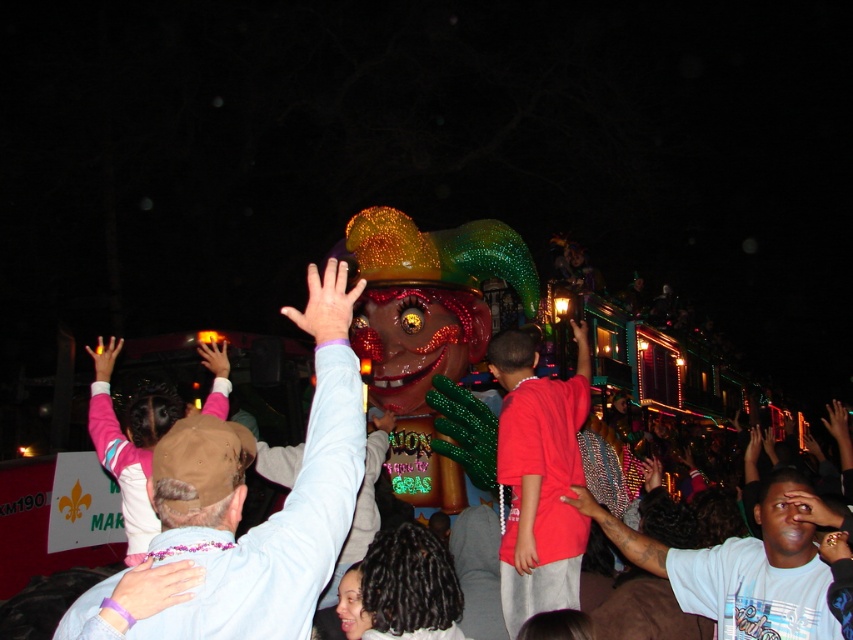
You are a photographer trying to capture a photo of the crowd at the parade. You notice two people wearing a light blue cotton shirt at upper center and a red matte shirt at center. Which person should you focus on first to ensure they are in sharp focus?

The light blue cotton shirt at upper center is closer to the viewer than the red matte shirt at center, so you should focus on the light blue cotton shirt at upper center first to ensure it is in sharp focus.

You are at a nighttime parade and see two people in the crowd. One is wearing a light blue cotton shirt at upper center and the other a red matte shirt at center. Which person is standing higher up in the crowd?

The light blue cotton shirt at upper center is located above the red matte shirt at center, so the person wearing the light blue cotton shirt at upper center is standing higher up in the crowd.